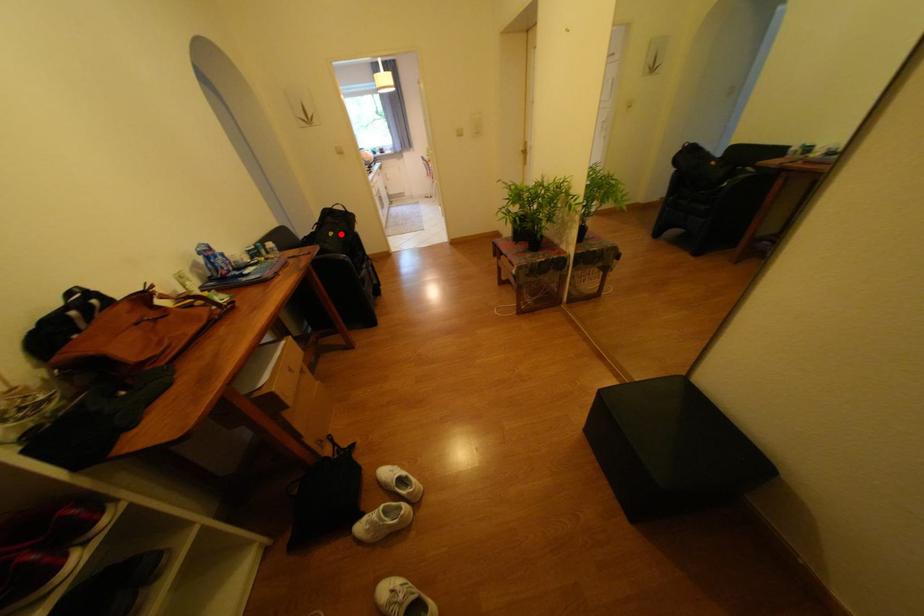
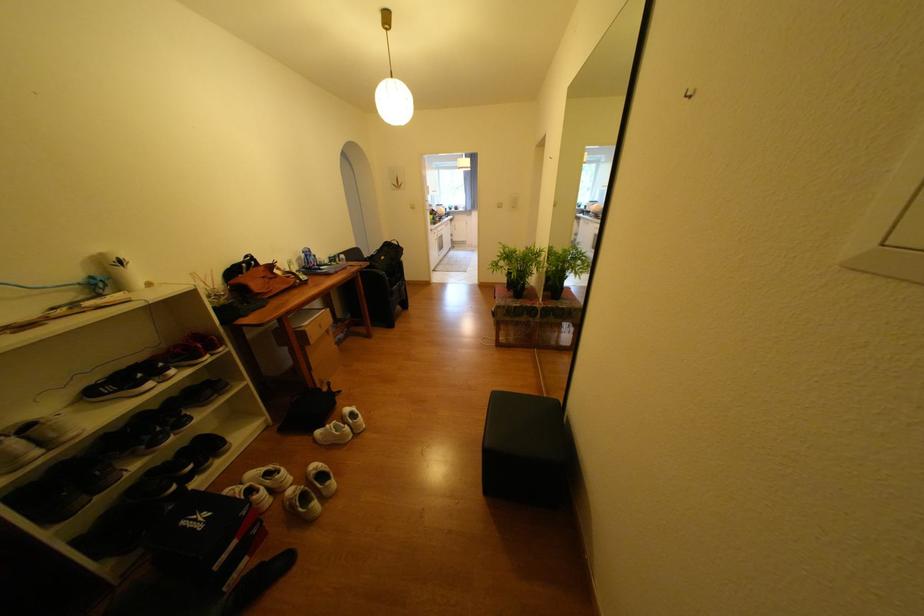
Question: I am providing you with two images of the same scene from different viewpoints. Image1 has a red point marked. In image2, the corresponding 3D location appears at what relative position? Reply with the corresponding letter.

Choices:
 (A) Closer
 (B) Farther

Answer: (A)